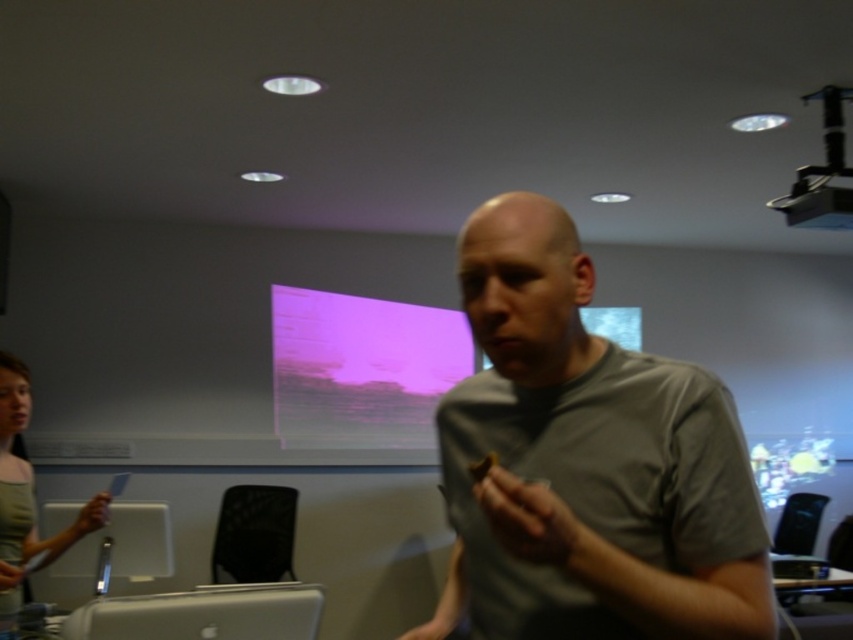
Question: Among these objects, which one is nearest to the camera?

Choices:
 (A) gray matte shirt at center
 (B) silver metallic laptop at lower left

Answer: (A)

Question: Which object is positioned farthest from the green fabric shirt at left?

Choices:
 (A) gray matte shirt at center
 (B) silver metallic laptop at lower left
 (C) purple matte projection screen at upper center

Answer: (C)

Question: Does gray matte shirt at center have a larger size compared to purple matte projection screen at upper center?

Choices:
 (A) no
 (B) yes

Answer: (A)

Question: Is silver metallic laptop at lower left positioned before green fabric shirt at left?

Choices:
 (A) yes
 (B) no

Answer: (A)

Question: Which object is the closest to the green fabric shirt at left?

Choices:
 (A) silver metallic laptop at lower left
 (B) black plastic projector at upper right

Answer: (A)

Question: Can you confirm if silver metallic laptop at lower left is positioned to the left of green fabric shirt at left?

Choices:
 (A) no
 (B) yes

Answer: (A)